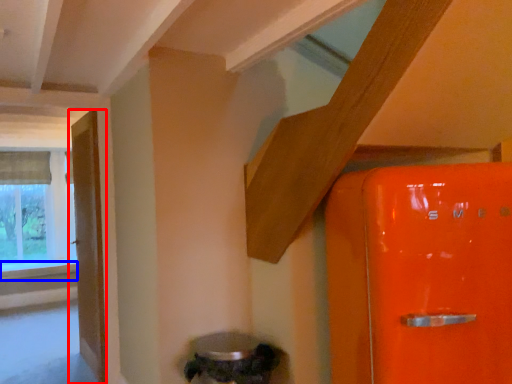
Question: Among these objects, which one is nearest to the camera, door (highlighted by a red box) or window sill (highlighted by a blue box)?

Choices:
 (A) door
 (B) window sill

Answer: (A)